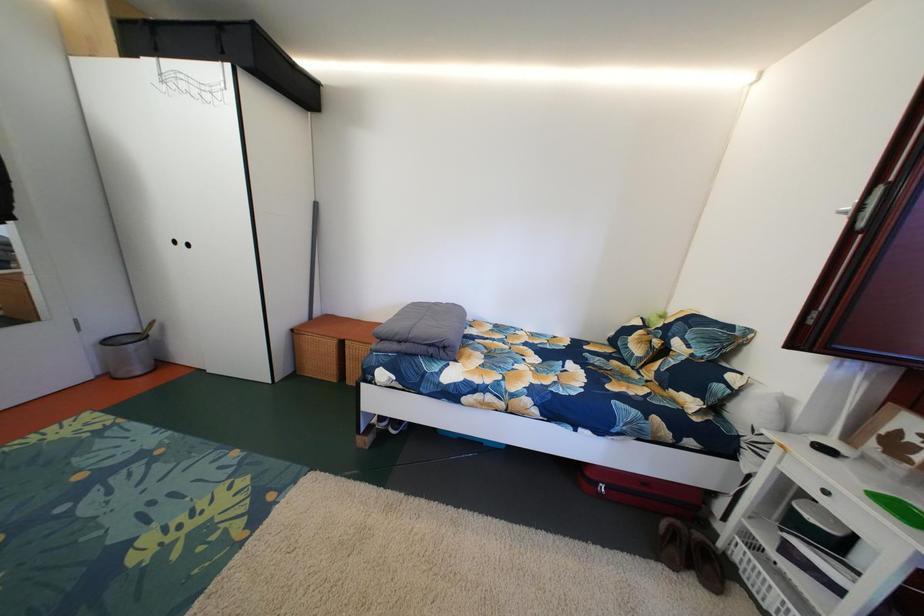
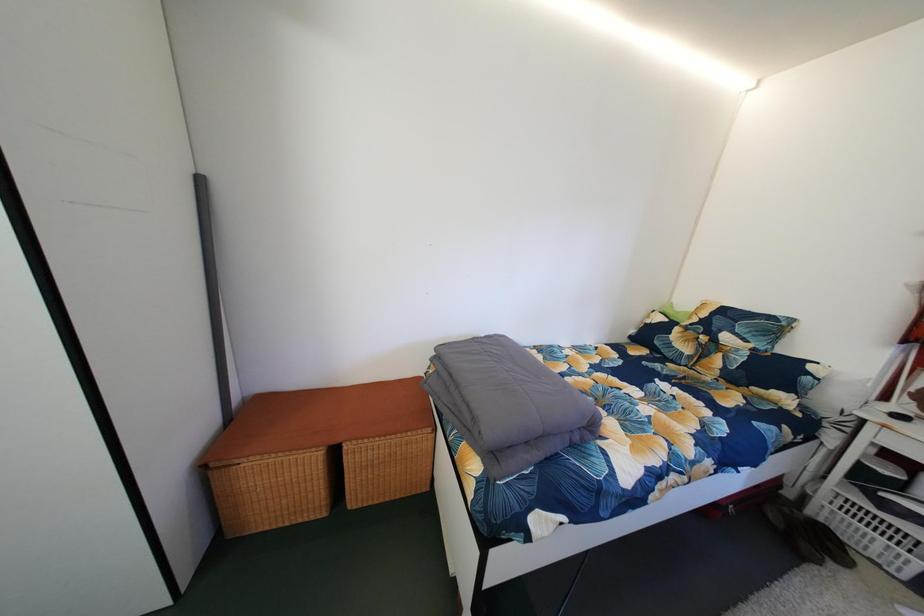
Which direction would the cameraman need to move to produce the second image?

The cameraman walked toward left, forward.